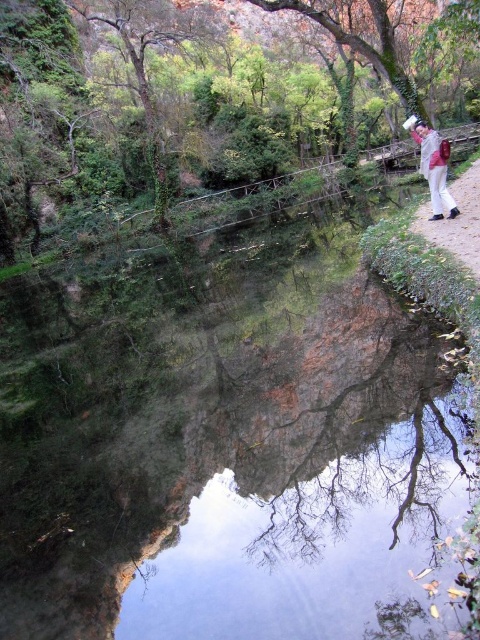
You are standing at the point with coordinates point (435, 148) and want to walk towards the point with coordinates point (45, 140). Will you be moving towards the foreground or the background of the image?

Moving towards the point (45, 140) from point (435, 148) means you are moving towards the background of the image because point (45, 140) is behind point (435, 148).

You are standing on the brown dirt path at right and want to take a photo of the green leafy tree at upper center. To frame the tree properly in your camera, should you move to your left or right side?

Since the green leafy tree at upper center is to the left of the brown dirt path at right, you should move to your left side to frame the tree properly in your camera.

Based on the photo, based on the scene description, where is the green leafy tree at upper center located in terms of its 2D coordinates?

The green leafy tree at upper center is located at the 2D coordinates of point (205, 100).